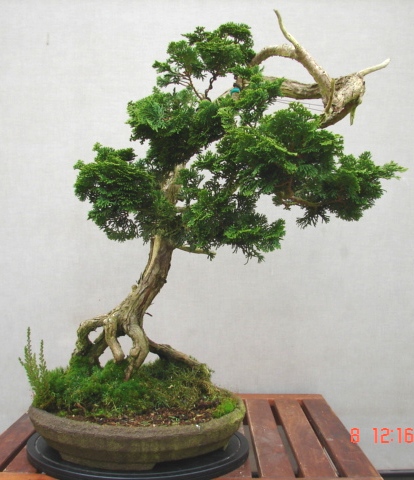
The image size is (414, 480). In order to click on pot in this screenshot , I will do `click(202, 442)`.